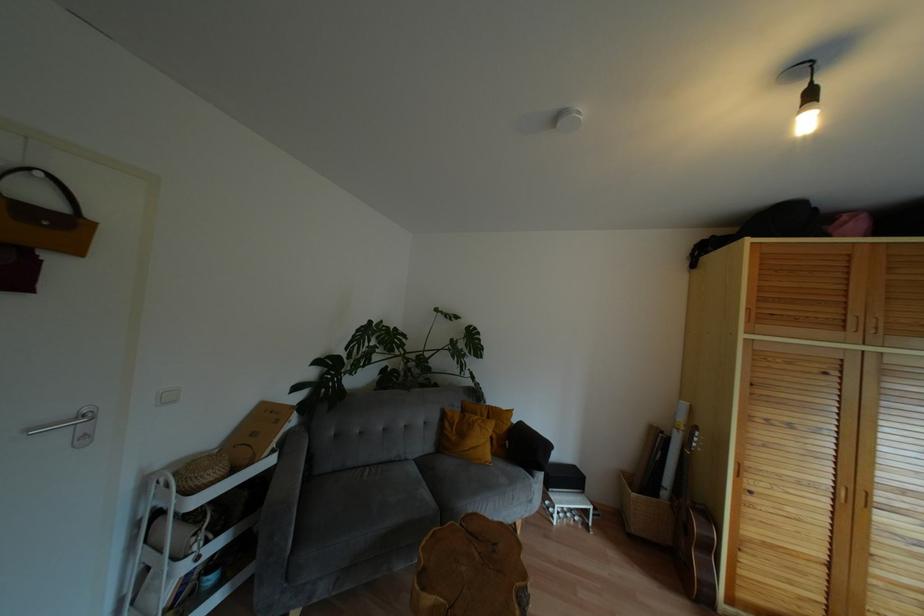
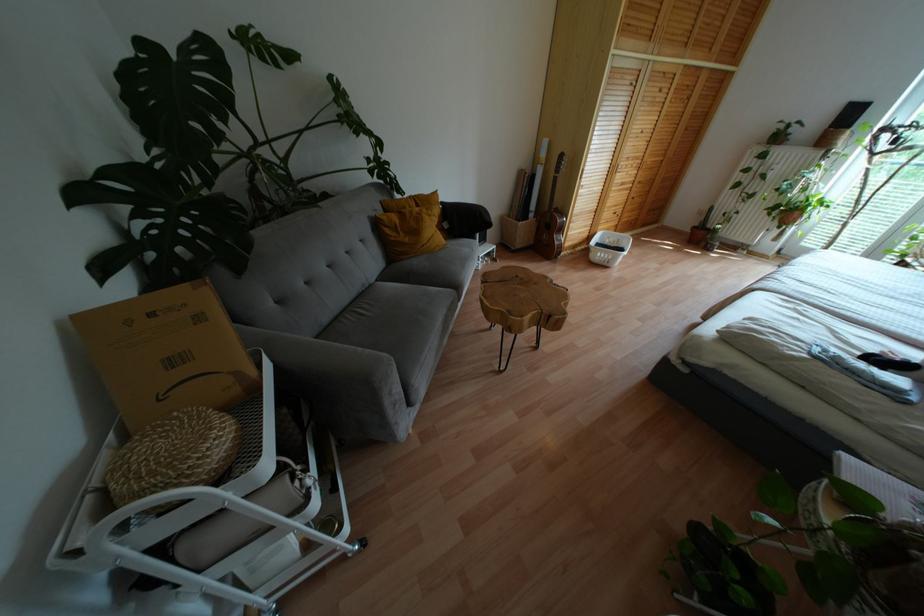
Where in the second image is the point corresponding to (406,459) from the first image?

(370, 284)